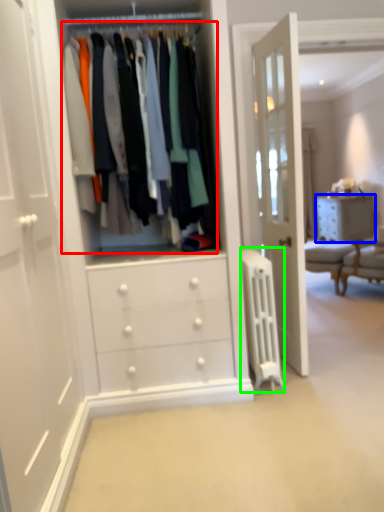
Question: Estimate the real-world distances between objects in this image. Which object is farther from closet (highlighted by a red box), chest of drawers (highlighted by a blue box) or wide (highlighted by a green box)?

Choices:
 (A) chest of drawers
 (B) wide

Answer: (A)